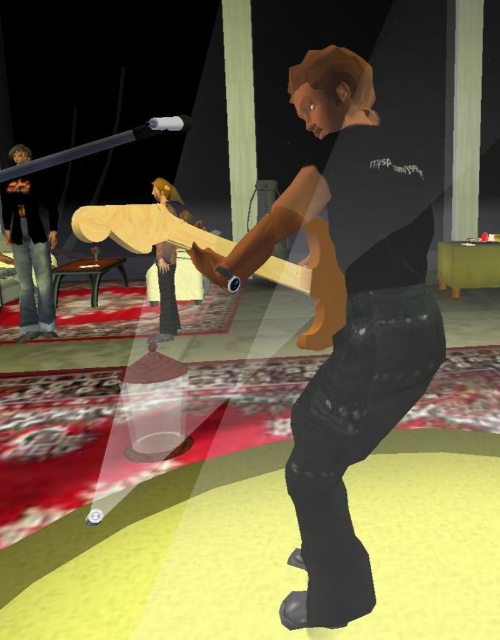
Question: Considering the real-world distances, which object is farthest from the wooden skateboard at center?

Choices:
 (A) denim jeans at left
 (B) brown matte shirt at center

Answer: (B)

Question: Is brown matte shirt at center closer to the viewer compared to denim jeans at left?

Choices:
 (A) yes
 (B) no

Answer: (A)

Question: Is brown matte shirt at center above wooden skateboard at center?

Choices:
 (A) yes
 (B) no

Answer: (B)

Question: In this image, where is brown matte shirt at center located relative to wooden skateboard at center?

Choices:
 (A) right
 (B) left

Answer: (A)

Question: Which point is farther to the camera?

Choices:
 (A) denim jeans at left
 (B) wooden skateboard at center
 (C) brown matte shirt at center

Answer: (A)

Question: Which of the following is the closest to the observer?

Choices:
 (A) denim jeans at left
 (B) brown matte shirt at center
 (C) wooden skateboard at center

Answer: (B)